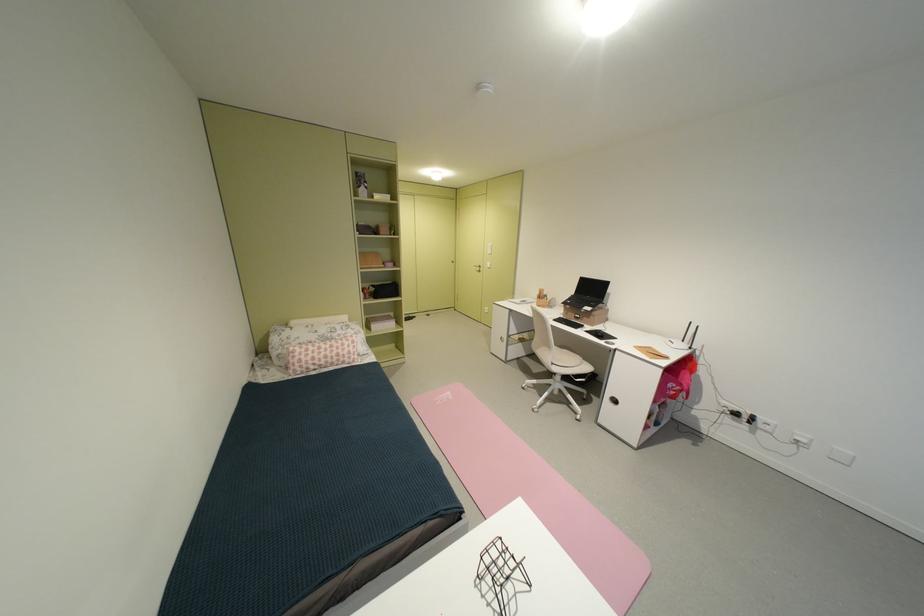
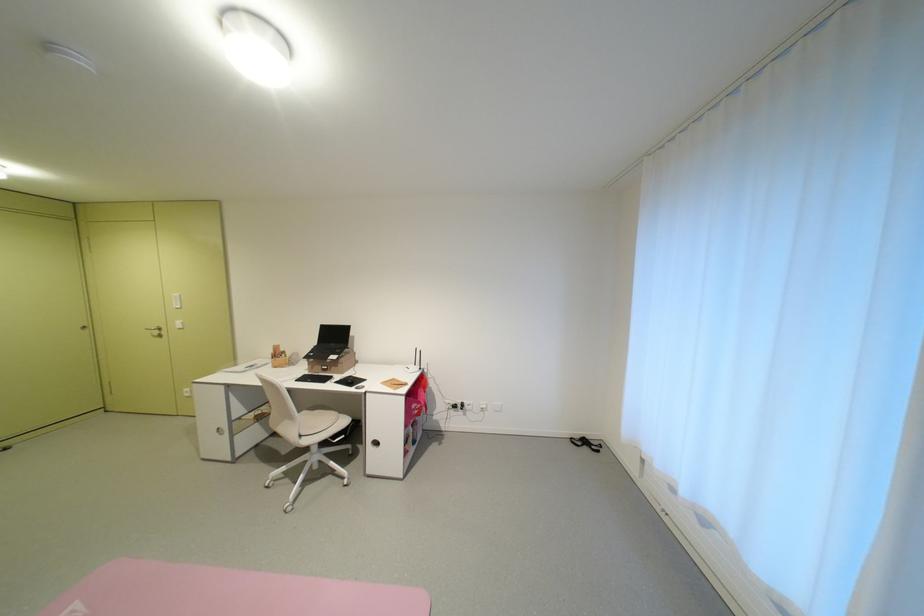
Locate, in the second image, the point that corresponds to (x=554, y=300) in the first image.

(293, 357)